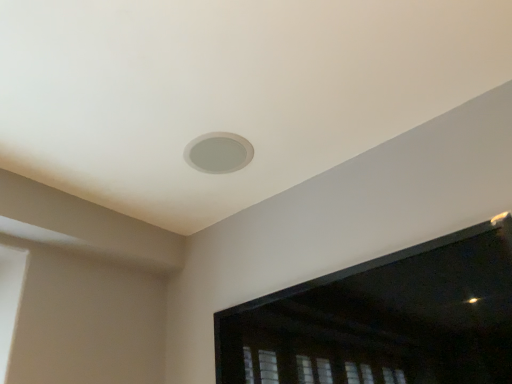
Locate an element on the screen. The image size is (512, 384). transparent plastic window screen at upper center is located at coordinates (384, 319).

What is the approximate height of transparent plastic window screen at upper center?

The height of transparent plastic window screen at upper center is 16.74 inches.

This screenshot has width=512, height=384. What do you see at coordinates (384, 319) in the screenshot?
I see `transparent plastic window screen at upper center` at bounding box center [384, 319].

Where is `white matte hole at center`? white matte hole at center is located at coordinates pyautogui.click(x=219, y=153).

Describe the element at coordinates (219, 153) in the screenshot. I see `white matte hole at center` at that location.

Based on the photo, measure the distance between white matte hole at center and camera.

1.41 meters.

The height and width of the screenshot is (384, 512). Identify the location of transparent plastic window screen at upper center. (384, 319).

In the image, is transparent plastic window screen at upper center on the left side or the right side of white matte hole at center?

From the image, it's evident that transparent plastic window screen at upper center is to the right of white matte hole at center.

Is transparent plastic window screen at upper center positioned behind white matte hole at center?

No.

Is point (461, 282) farther from viewer compared to point (224, 157)?

No, it is not.

From the image's perspective, which is above, transparent plastic window screen at upper center or white matte hole at center?

white matte hole at center.

From a real-world perspective, does transparent plastic window screen at upper center stand above white matte hole at center?

Incorrect, from a real-world perspective, transparent plastic window screen at upper center is lower than white matte hole at center.

Which of these two, transparent plastic window screen at upper center or white matte hole at center, is wider?

white matte hole at center is wider.

Based on the photo, is transparent plastic window screen at upper center shorter than white matte hole at center?

Incorrect, the height of transparent plastic window screen at upper center does not fall short of that of white matte hole at center.

Considering the relative sizes of transparent plastic window screen at upper center and white matte hole at center in the image provided, is transparent plastic window screen at upper center bigger than white matte hole at center?

Indeed, transparent plastic window screen at upper center has a larger size compared to white matte hole at center.

Is white matte hole at center inside transparent plastic window screen at upper center?

No, white matte hole at center is not surrounded by transparent plastic window screen at upper center.

Would you consider transparent plastic window screen at upper center to be distant from white matte hole at center?

No, transparent plastic window screen at upper center is not far from white matte hole at center.

Could you tell me if transparent plastic window screen at upper center is turned towards white matte hole at center?

No.

What's the angular difference between transparent plastic window screen at upper center and white matte hole at center's facing directions?

0.156 degrees separate the facing orientations of transparent plastic window screen at upper center and white matte hole at center.

Based on the photo, how much distance is there between transparent plastic window screen at upper center and white matte hole at center?

They are 66.28 centimeters apart.

Locate an element on the screen. The height and width of the screenshot is (384, 512). window screen beneath the white matte hole at center (from a real-world perspective) is located at coordinates (384, 319).

Does white matte hole at center appear on the left side of transparent plastic window screen at upper center?

Yes, white matte hole at center is to the left of transparent plastic window screen at upper center.

Is white matte hole at center further to camera compared to transparent plastic window screen at upper center?

Yes, it is.

Which point is more distant from viewer, (x=232, y=141) or (x=409, y=265)?

The point (x=232, y=141) is farther from the camera.

From the image's perspective, is white matte hole at center under transparent plastic window screen at upper center?

No, from the image's perspective, white matte hole at center is not beneath transparent plastic window screen at upper center.

From a real-world perspective, is white matte hole at center above or below transparent plastic window screen at upper center?

white matte hole at center is situated higher than transparent plastic window screen at upper center in the real world.

Does white matte hole at center have a greater width compared to transparent plastic window screen at upper center?

Indeed, white matte hole at center has a greater width compared to transparent plastic window screen at upper center.

Who is shorter, white matte hole at center or transparent plastic window screen at upper center?

Standing shorter between the two is white matte hole at center.

Considering the relative sizes of white matte hole at center and transparent plastic window screen at upper center in the image provided, is white matte hole at center smaller than transparent plastic window screen at upper center?

Correct, white matte hole at center occupies less space than transparent plastic window screen at upper center.

Can we say white matte hole at center lies outside transparent plastic window screen at upper center?

Yes, white matte hole at center is outside of transparent plastic window screen at upper center.

Is white matte hole at center not near transparent plastic window screen at upper center?

white matte hole at center is actually quite close to transparent plastic window screen at upper center.

Is white matte hole at center oriented towards transparent plastic window screen at upper center?

No, white matte hole at center is not turned towards transparent plastic window screen at upper center.

Can you tell me how much white matte hole at center and transparent plastic window screen at upper center differ in facing direction?

0.156 degrees separate the facing orientations of white matte hole at center and transparent plastic window screen at upper center.

Locate an element on the screen. This screenshot has width=512, height=384. hole that appears behind the transparent plastic window screen at upper center is located at coordinates (219, 153).

This screenshot has height=384, width=512. Find the location of `hole that appears behind the transparent plastic window screen at upper center`. hole that appears behind the transparent plastic window screen at upper center is located at coordinates (219, 153).

Locate an element on the screen. Image resolution: width=512 pixels, height=384 pixels. hole above the transparent plastic window screen at upper center (from a real-world perspective) is located at coordinates (219, 153).